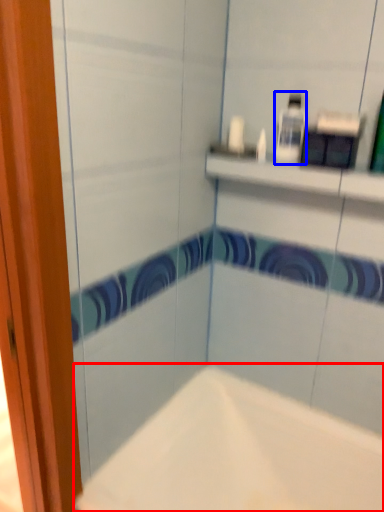
Question: Which object appears farthest to the camera in this image, bathtub (highlighted by a red box) or toiletry (highlighted by a blue box)?

Choices:
 (A) bathtub
 (B) toiletry

Answer: (B)